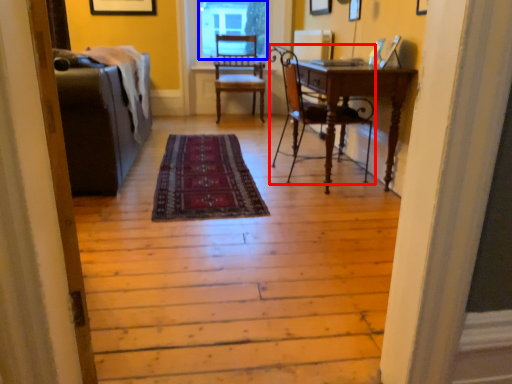
Question: Which point is further to the camera, chair (highlighted by a red box) or window screen (highlighted by a blue box)?

Choices:
 (A) chair
 (B) window screen

Answer: (B)